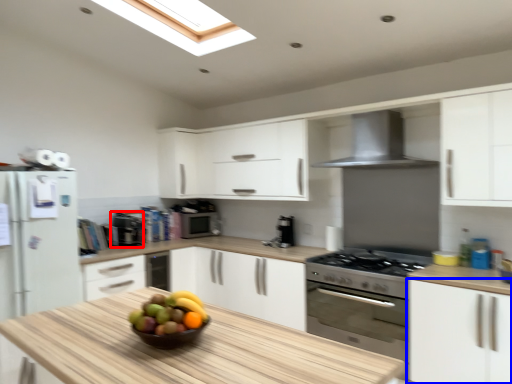
Question: Which of the following is the closest to the observer, appliance (highlighted by a red box) or cabinetry (highlighted by a blue box)?

Choices:
 (A) appliance
 (B) cabinetry

Answer: (B)